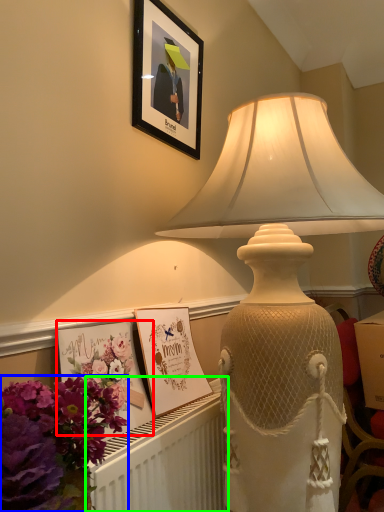
Question: Which is nearer to the postcard (highlighted by a red box)? flower (highlighted by a blue box) or radiator (highlighted by a green box).

Choices:
 (A) flower
 (B) radiator

Answer: (B)